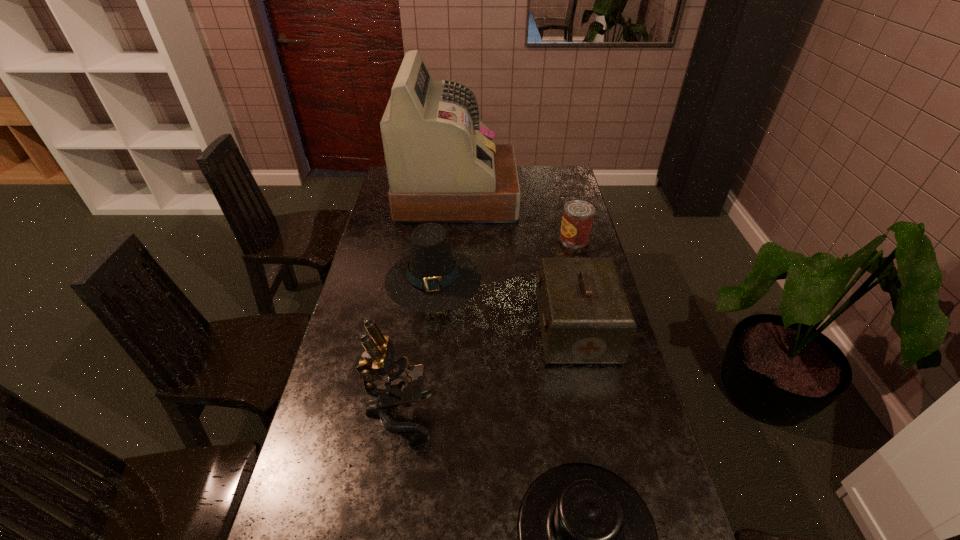
This screenshot has width=960, height=540. I want to click on the farthest object, so click(x=443, y=167).

You are a GUI agent. You are given a task and a screenshot of the screen. Output one action in this format:
    pyautogui.click(x=<x>, y=<y>)
    Task: Click on the tallest object
    The height and width of the screenshot is (540, 960).
    Given the screenshot: What is the action you would take?
    pyautogui.click(x=443, y=167)

Locate an element on the screen. The height and width of the screenshot is (540, 960). the second tallest object is located at coordinates (403, 381).

The image size is (960, 540). Find the location of `microscope`. microscope is located at coordinates (403, 381).

Locate an element on the screen. The width and height of the screenshot is (960, 540). the first-aid kit is located at coordinates (585, 318).

The height and width of the screenshot is (540, 960). I want to click on the taller dress hat, so click(x=432, y=278).

Find the location of a particular element. The image size is (960, 540). the left dress hat is located at coordinates (432, 278).

You are a GUI agent. You are given a task and a screenshot of the screen. Output one action in this format:
    pyautogui.click(x=<x>, y=<y>)
    Task: Click on the second farthest object
    
    Given the screenshot: What is the action you would take?
    pyautogui.click(x=578, y=215)

Locate an element on the screen. This screenshot has height=540, width=960. the fifth tallest object is located at coordinates (578, 215).

The height and width of the screenshot is (540, 960). I want to click on free location located 0.170m on the operating side of the tallest object, so click(553, 195).